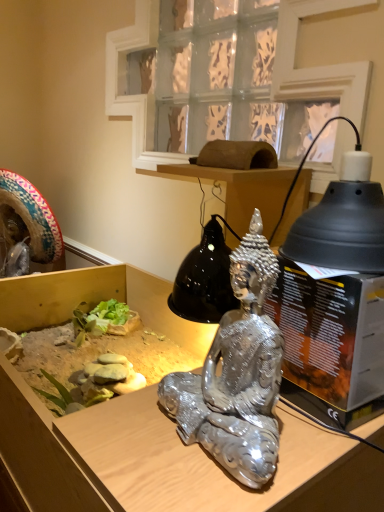
Question: From a real-world perspective, is black matte lampshade at upper right positioned above or below shiny silver statue at center?

Choices:
 (A) below
 (B) above

Answer: (B)

Question: From the image's perspective, is black matte lampshade at upper right above or below shiny silver statue at center?

Choices:
 (A) above
 (B) below

Answer: (A)

Question: Which of these objects is positioned farthest from the metallic statue at center?

Choices:
 (A) shiny silver statue at center
 (B) black matte lampshade at upper right
 (C) clear glass window at upper center

Answer: (C)

Question: Which object is positioned closest to the clear glass window at upper center?

Choices:
 (A) metallic statue at center
 (B) black matte lampshade at upper right
 (C) shiny silver statue at center

Answer: (B)